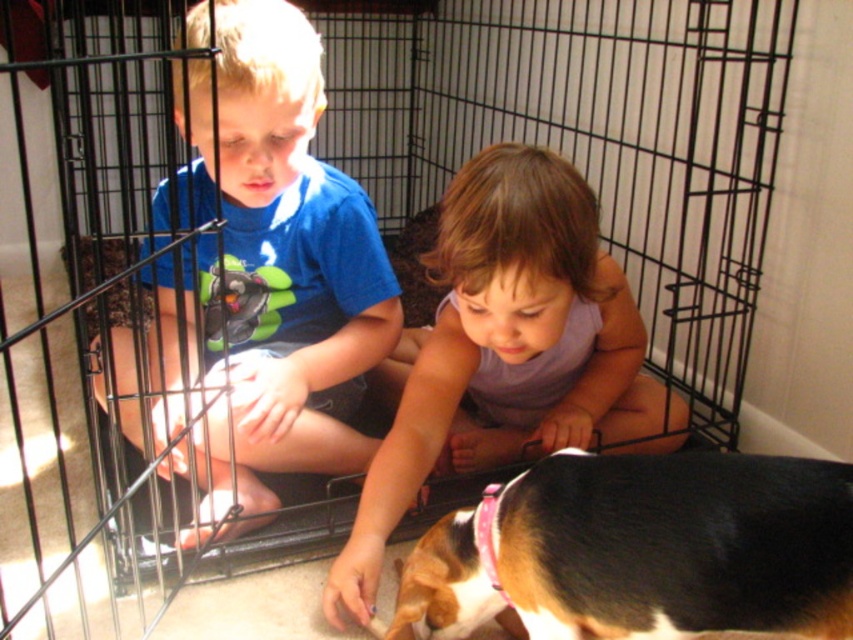
Which of these two, blue cotton shirt at left or black and white fur at lower right, stands shorter?

With less height is black and white fur at lower right.

Who is positioned more to the right, blue cotton shirt at left or black and white fur at lower right?

From the viewer's perspective, black and white fur at lower right appears more on the right side.

Is point (160, 214) in front of point (630, 566)?

No, (160, 214) is behind (630, 566).

Identify the location of blue cotton shirt at left. Image resolution: width=853 pixels, height=640 pixels. (273, 282).

Which of these two, black and white fur at lower right or pastel purple fabric at center, stands taller?

Standing taller between the two is pastel purple fabric at center.

Who is lower down, black and white fur at lower right or pastel purple fabric at center?

black and white fur at lower right is lower down.

Describe the element at coordinates (677, 545) in the screenshot. I see `black and white fur at lower right` at that location.

Find the location of a particular element. This screenshot has width=853, height=640. black and white fur at lower right is located at coordinates (677, 545).

Is blue cotton shirt at left positioned in front of pastel purple fabric at center?

Yes, it is.

Is point (201, 472) farther from camera compared to point (393, 483)?

Yes, point (201, 472) is farther from viewer.

Who is more distant from viewer, (294,106) or (641,358)?

The point (641,358) is behind.

At what (x,y) coordinates should I click in order to perform the action: click on blue cotton shirt at left. Please return your answer as a coordinate pair (x, y). Image resolution: width=853 pixels, height=640 pixels. Looking at the image, I should click on point(273,282).